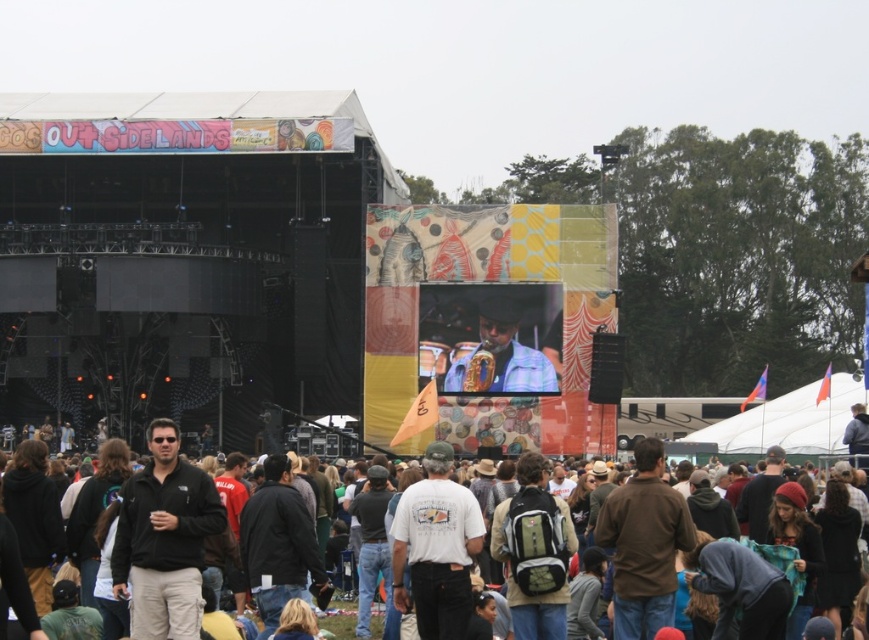
Question: Among these points, which one is nearest to the camera?

Choices:
 (A) (211, 632)
 (B) (141, 634)
 (C) (523, 356)

Answer: (B)

Question: Is black matte jacket at center to the right of black jacket at center from the viewer's perspective?

Choices:
 (A) no
 (B) yes

Answer: (A)

Question: Which point is farther to the camera?

Choices:
 (A) black matte jacket at center
 (B) black jacket at center

Answer: (A)

Question: Can you confirm if black matte jacket at center is positioned above matte blue shirt at center?

Choices:
 (A) no
 (B) yes

Answer: (A)

Question: Which point appears closest to the camera in this image?

Choices:
 (A) (458, 385)
 (B) (186, 532)

Answer: (B)

Question: Is black matte jacket at center to the right of matte blue shirt at center from the viewer's perspective?

Choices:
 (A) yes
 (B) no

Answer: (B)